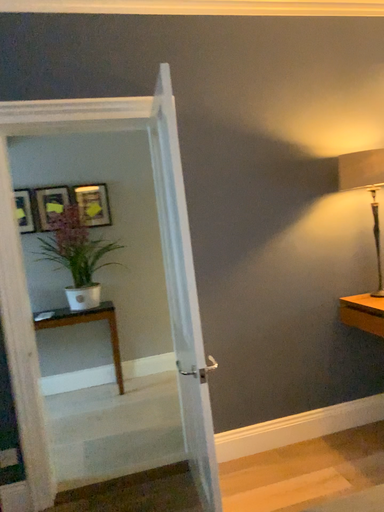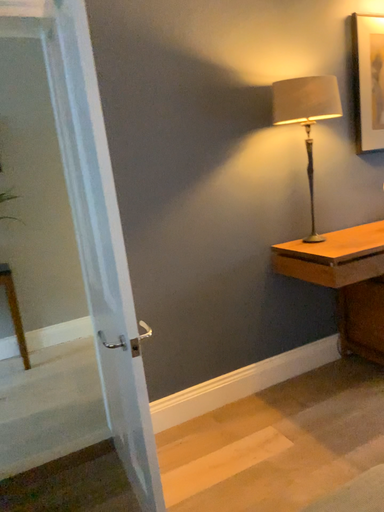
Question: How did the camera likely rotate when shooting the video?

Choices:
 (A) rotated right
 (B) rotated left

Answer: (A)